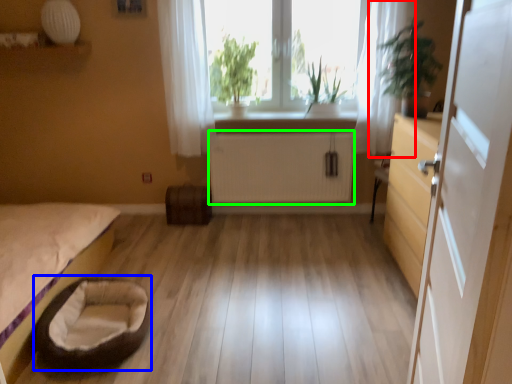
Question: Estimate the real-world distances between objects in this image. Which object is closer to curtain (highlighted by a red box), infant bed (highlighted by a blue box) or radiator (highlighted by a green box)?

Choices:
 (A) infant bed
 (B) radiator

Answer: (B)